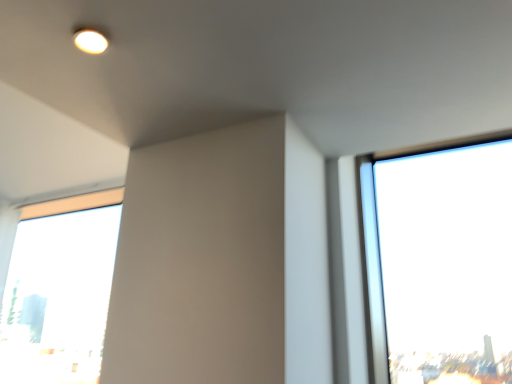
Question: Should I look upward or downward to see matte white light fixture at upper left?

Choices:
 (A) down
 (B) up

Answer: (B)

Question: Can you confirm if matte white light fixture at upper left is bigger than transparent glass window at lower left?

Choices:
 (A) no
 (B) yes

Answer: (A)

Question: Is matte white light fixture at upper left further to the viewer compared to transparent glass window at lower left?

Choices:
 (A) no
 (B) yes

Answer: (A)

Question: Is matte white light fixture at upper left turned away from transparent glass window at lower left?

Choices:
 (A) yes
 (B) no

Answer: (B)

Question: Is matte white light fixture at upper left outside transparent glass window at lower left?

Choices:
 (A) no
 (B) yes

Answer: (B)

Question: Does matte white light fixture at upper left have a lesser height compared to transparent glass window at lower left?

Choices:
 (A) no
 (B) yes

Answer: (B)

Question: Is matte white light fixture at upper left smaller than transparent glass window at lower left?

Choices:
 (A) yes
 (B) no

Answer: (A)

Question: Is transparent glass window at lower left looking in the opposite direction of matte white light fixture at upper left?

Choices:
 (A) yes
 (B) no

Answer: (B)

Question: Considering the relative sizes of transparent glass window at lower left and matte white light fixture at upper left in the image provided, is transparent glass window at lower left bigger than matte white light fixture at upper left?

Choices:
 (A) yes
 (B) no

Answer: (A)

Question: From a real-world perspective, does transparent glass window at lower left stand above matte white light fixture at upper left?

Choices:
 (A) yes
 (B) no

Answer: (B)

Question: Is transparent glass window at lower left at the right side of matte white light fixture at upper left?

Choices:
 (A) yes
 (B) no

Answer: (B)

Question: Is transparent glass window at lower left positioned in front of matte white light fixture at upper left?

Choices:
 (A) no
 (B) yes

Answer: (A)

Question: Is transparent glass window at lower left taller than matte white light fixture at upper left?

Choices:
 (A) yes
 (B) no

Answer: (A)

Question: Based on their sizes in the image, would you say transparent glass window at lower left is bigger or smaller than matte white light fixture at upper left?

Choices:
 (A) big
 (B) small

Answer: (A)